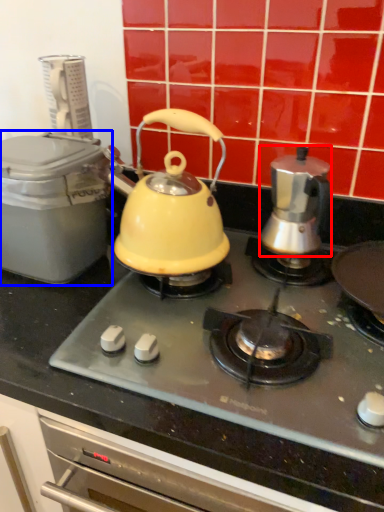
Question: Among these objects, which one is farthest to the camera, kettle (highlighted by a red box) or kitchen appliance (highlighted by a blue box)?

Choices:
 (A) kettle
 (B) kitchen appliance

Answer: (A)